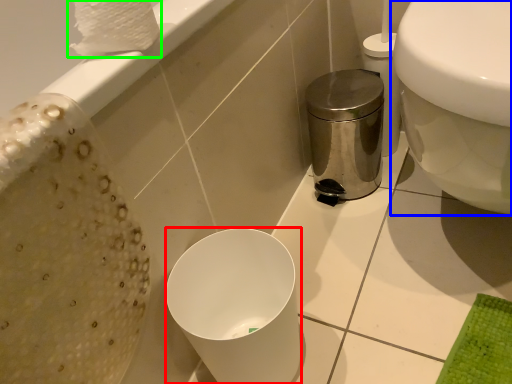
Question: Based on their relative distances, which object is farther from bidet (highlighted by a red box)? Choose from toilet (highlighted by a blue box) and toilet paper (highlighted by a green box).

Choices:
 (A) toilet
 (B) toilet paper

Answer: (B)